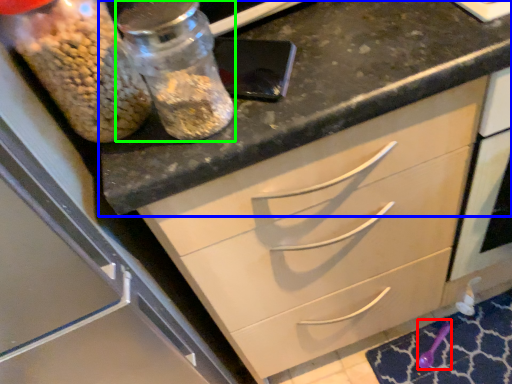
Question: Which is nearer to the utensil (highlighted by a red box)? countertop (highlighted by a blue box) or glass jar (highlighted by a green box).

Choices:
 (A) countertop
 (B) glass jar

Answer: (A)